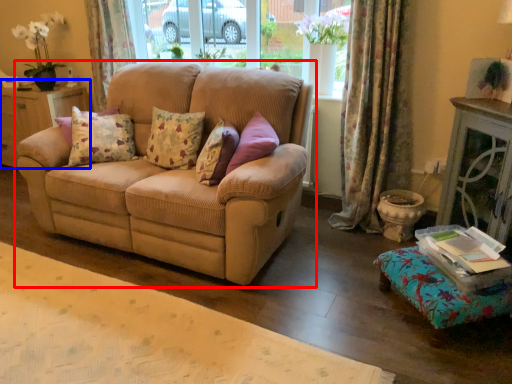
Question: Which object appears closest to the camera in this image, studio couch (highlighted by a red box) or dresser (highlighted by a blue box)?

Choices:
 (A) studio couch
 (B) dresser

Answer: (A)